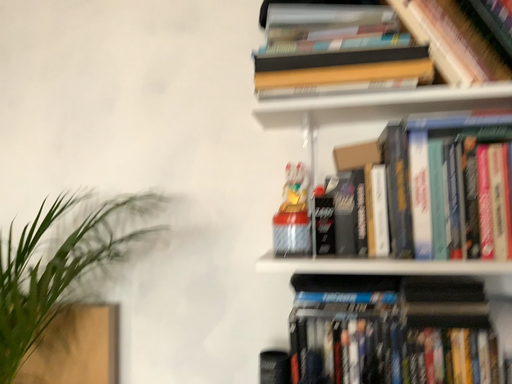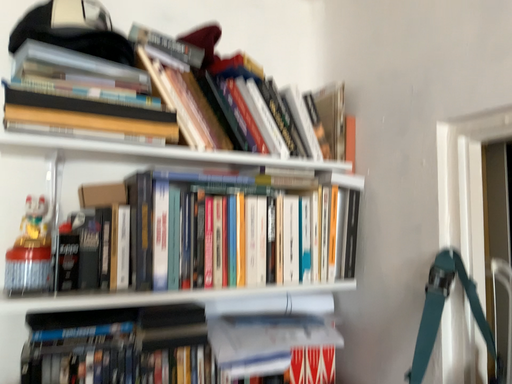
Question: How did the camera likely rotate when shooting the video?

Choices:
 (A) rotated right
 (B) rotated left

Answer: (A)